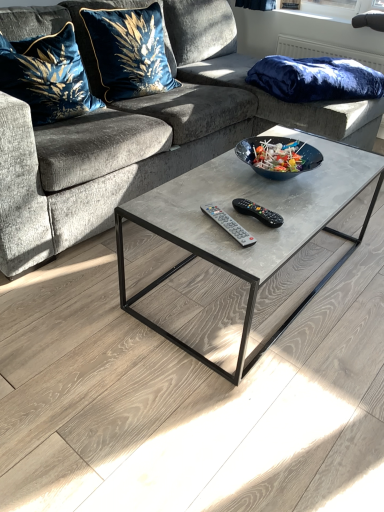
Find the location of `transparent plastic window screen at upper right`. transparent plastic window screen at upper right is located at coordinates (336, 7).

In order to face velvet fabric couch at center, should I rotate leftwards or rightwards?

Rotate your view left by about 2.343°.

How much space does matte black remote at center, placed as the 1th remote when sorted from left to right, occupy vertically?

It is 1.13 inches.

Find the location of `black plastic remote at center, marked as the 1th remote in a right-to-left arrangement`. black plastic remote at center, marked as the 1th remote in a right-to-left arrangement is located at coordinates (257, 212).

Measure the distance between velvet blue pillow at upper left, which appears as the second pillow when viewed from the left, and velvet fabric couch at center.

17.21 inches.

Considering the relative positions of velvet blue pillow at upper left, which appears as the second pillow when viewed from the right, and velvet fabric couch at center in the image provided, is velvet blue pillow at upper left, which appears as the second pillow when viewed from the right, in front of velvet fabric couch at center?

No, the depth of velvet blue pillow at upper left, which appears as the second pillow when viewed from the right, is greater than that of velvet fabric couch at center.

You are a GUI agent. You are given a task and a screenshot of the screen. Output one action in this format:
    pyautogui.click(x=<x>, y=<y>)
    Task: Click on the studio couch in front of the velvet blue pillow at upper left, which appears as the second pillow when viewed from the left
    Image resolution: width=384 pixels, height=512 pixels.
    Given the screenshot: What is the action you would take?
    pyautogui.click(x=144, y=139)

Does point (83, 136) lie behind point (366, 75)?

No, (83, 136) is in front of (366, 75).

In the scene shown: Is velvety blue pillow at upper right, arranged as the 1th pillow when viewed from the right, located within velvet fabric couch at center?

Yes, velvety blue pillow at upper right, arranged as the 1th pillow when viewed from the right, is a part of velvet fabric couch at center.

Would you say velvet fabric couch at center is a long distance from velvety blue pillow at upper right, which is counted as the third pillow, starting from the left?

velvet fabric couch at center is actually quite close to velvety blue pillow at upper right, which is counted as the third pillow, starting from the left.

From the image's perspective, between velvet fabric couch at center and velvety blue pillow at upper right, arranged as the 1th pillow when viewed from the right, who is located below?

velvet fabric couch at center is shown below in the image.

Is velvety blue pillow at upper right, arranged as the 1th pillow when viewed from the right, smaller than velvet blue pillow at upper left, marked as the first pillow in a left-to-right arrangement?

Yes.

Looking at this image, in terms of width, does velvety blue pillow at upper right, arranged as the 1th pillow when viewed from the right, look wider or thinner when compared to velvet blue pillow at upper left, marked as the first pillow in a left-to-right arrangement?

Considering their sizes, velvety blue pillow at upper right, arranged as the 1th pillow when viewed from the right, looks broader than velvet blue pillow at upper left, marked as the first pillow in a left-to-right arrangement.

Between velvety blue pillow at upper right, arranged as the 1th pillow when viewed from the right, and velvet blue pillow at upper left, marked as the first pillow in a left-to-right arrangement, which one has less height?

velvety blue pillow at upper right, arranged as the 1th pillow when viewed from the right.

From a real-world perspective, between velvety blue pillow at upper right, arranged as the 1th pillow when viewed from the right, and velvet blue pillow at upper left, marked as the first pillow in a left-to-right arrangement, who is vertically lower?

In real-world perspective, velvety blue pillow at upper right, arranged as the 1th pillow when viewed from the right, is lower.

Is matte black remote at center, which is counted as the 2th remote, starting from the right, at the right side of velvet fabric couch at center?

Yes.

From the image's perspective, does matte black remote at center, which is counted as the 2th remote, starting from the right, appear higher than velvet fabric couch at center?

No.

From a real-world perspective, is matte black remote at center, placed as the 1th remote when sorted from left to right, located beneath velvet fabric couch at center?

Yes, from a real-world perspective, matte black remote at center, placed as the 1th remote when sorted from left to right, is below velvet fabric couch at center.

In the scene shown: Is matte black remote at center, placed as the 1th remote when sorted from left to right, positioned with its back to velvet fabric couch at center?

Yes, velvet fabric couch at center is at the back of matte black remote at center, placed as the 1th remote when sorted from left to right.

From a real-world perspective, does black plastic remote at center, the 2th remote in the left-to-right sequence, sit lower than velvet blue pillow at upper left, which appears as the third pillow when viewed from the right?

Yes, from a real-world perspective, black plastic remote at center, the 2th remote in the left-to-right sequence, is under velvet blue pillow at upper left, which appears as the third pillow when viewed from the right.

From the image's perspective, is black plastic remote at center, the 2th remote in the left-to-right sequence, located above velvet blue pillow at upper left, which appears as the third pillow when viewed from the right?

No, from the image's perspective, black plastic remote at center, the 2th remote in the left-to-right sequence, is not above velvet blue pillow at upper left, which appears as the third pillow when viewed from the right.

Is black plastic remote at center, the 2th remote in the left-to-right sequence, to the right of velvet blue pillow at upper left, which appears as the third pillow when viewed from the right, from the viewer's perspective?

Yes.

Does point (53, 46) come closer to viewer compared to point (317, 101)?

Yes, point (53, 46) is in front of point (317, 101).

Does velvet blue pillow at upper left, marked as the first pillow in a left-to-right arrangement, have a lesser height compared to velvety blue pillow at upper right, arranged as the 1th pillow when viewed from the right?

No, velvet blue pillow at upper left, marked as the first pillow in a left-to-right arrangement, is not shorter than velvety blue pillow at upper right, arranged as the 1th pillow when viewed from the right.

Which is more to the right, velvet blue pillow at upper left, marked as the first pillow in a left-to-right arrangement, or velvety blue pillow at upper right, arranged as the 1th pillow when viewed from the right?

velvety blue pillow at upper right, arranged as the 1th pillow when viewed from the right.

Is velvet blue pillow at upper left, which appears as the second pillow when viewed from the right, thinner than velvety blue pillow at upper right, arranged as the 1th pillow when viewed from the right?

Yes, velvet blue pillow at upper left, which appears as the second pillow when viewed from the right, is thinner than velvety blue pillow at upper right, arranged as the 1th pillow when viewed from the right.

Is velvet blue pillow at upper left, which appears as the second pillow when viewed from the left, positioned far away from velvety blue pillow at upper right, arranged as the 1th pillow when viewed from the right?

No.

Consider the image. From a real-world perspective, is velvet blue pillow at upper left, which appears as the second pillow when viewed from the left, on velvety blue pillow at upper right, which is counted as the third pillow, starting from the left?

Yes, from a real-world perspective, velvet blue pillow at upper left, which appears as the second pillow when viewed from the left, is above velvety blue pillow at upper right, which is counted as the third pillow, starting from the left.

Is velvet blue pillow at upper left, which appears as the second pillow when viewed from the right, turned away from velvety blue pillow at upper right, arranged as the 1th pillow when viewed from the right?

No, velvet blue pillow at upper left, which appears as the second pillow when viewed from the right, is not facing the opposite direction of velvety blue pillow at upper right, arranged as the 1th pillow when viewed from the right.

This screenshot has width=384, height=512. I want to click on the 1st pillow counting from the left of the velvet fabric couch at center, so click(125, 52).

The height and width of the screenshot is (512, 384). What are the coordinates of `studio couch below the velvety blue pillow at upper right, which is counted as the third pillow, starting from the left (from a real-world perspective)` in the screenshot? It's located at pyautogui.click(x=144, y=139).

From the image, which object appears to be farther from velvet blue pillow at upper left, which appears as the second pillow when viewed from the right, velvet fabric couch at center or velvet blue pillow at upper left, marked as the first pillow in a left-to-right arrangement?

Based on the image, velvet fabric couch at center appears to be further to velvet blue pillow at upper left, which appears as the second pillow when viewed from the right.

Estimate the real-world distances between objects in this image. Which object is closer to velvet blue pillow at upper left, which appears as the second pillow when viewed from the left, black plastic remote at center, marked as the 1th remote in a right-to-left arrangement, or velvet blue pillow at upper left, marked as the first pillow in a left-to-right arrangement?

Based on the image, velvet blue pillow at upper left, marked as the first pillow in a left-to-right arrangement, appears to be nearer to velvet blue pillow at upper left, which appears as the second pillow when viewed from the left.

Considering their positions, is velvet fabric couch at center positioned further to matte black remote at center, which is counted as the 2th remote, starting from the right, than velvet blue pillow at upper left, which appears as the third pillow when viewed from the right?

velvet blue pillow at upper left, which appears as the third pillow when viewed from the right, is positioned further to the anchor matte black remote at center, which is counted as the 2th remote, starting from the right.

Based on their spatial positions, is velvety blue pillow at upper right, which is counted as the third pillow, starting from the left, or matte black remote at center, which is counted as the 2th remote, starting from the right, closer to velvet blue pillow at upper left, which appears as the third pillow when viewed from the right?

matte black remote at center, which is counted as the 2th remote, starting from the right.

Looking at the image, which one is located further to transparent plastic window screen at upper right, velvet fabric couch at center or velvet blue pillow at upper left, marked as the first pillow in a left-to-right arrangement?

The object further to transparent plastic window screen at upper right is velvet blue pillow at upper left, marked as the first pillow in a left-to-right arrangement.

Estimate the real-world distances between objects in this image. Which object is further from black plastic remote at center, the 2th remote in the left-to-right sequence, velvet blue pillow at upper left, which appears as the second pillow when viewed from the left, or matte black remote at center, placed as the 1th remote when sorted from left to right?

The object further to black plastic remote at center, the 2th remote in the left-to-right sequence, is velvet blue pillow at upper left, which appears as the second pillow when viewed from the left.

Considering their positions, is velvet blue pillow at upper left, which appears as the third pillow when viewed from the right, positioned further to velvety blue pillow at upper right, which is counted as the third pillow, starting from the left, than velvet blue pillow at upper left, which appears as the second pillow when viewed from the left?

Based on the image, velvet blue pillow at upper left, which appears as the third pillow when viewed from the right, appears to be further to velvety blue pillow at upper right, which is counted as the third pillow, starting from the left.

From the image, which object appears to be farther from matte black remote at center, which is counted as the 2th remote, starting from the right, velvet fabric couch at center or velvet blue pillow at upper left, which appears as the second pillow when viewed from the right?

velvet blue pillow at upper left, which appears as the second pillow when viewed from the right, is positioned further to the anchor matte black remote at center, which is counted as the 2th remote, starting from the right.

Image resolution: width=384 pixels, height=512 pixels. Identify the location of remote situated between velvet blue pillow at upper left, which appears as the third pillow when viewed from the right, and black plastic remote at center, the 2th remote in the left-to-right sequence, from left to right. (229, 225).

Identify the location of remote that lies between velvet fabric couch at center and matte black remote at center, which is counted as the 2th remote, starting from the right, from top to bottom. (257, 212).

What are the coordinates of `studio couch between velvet blue pillow at upper left, marked as the first pillow in a left-to-right arrangement, and matte black remote at center, placed as the 1th remote when sorted from left to right, in the up-down direction` in the screenshot? It's located at (144, 139).

Find the location of a particular element. pillow between velvet fabric couch at center and velvet blue pillow at upper left, which appears as the second pillow when viewed from the left, in the front-back direction is located at coordinates (47, 76).